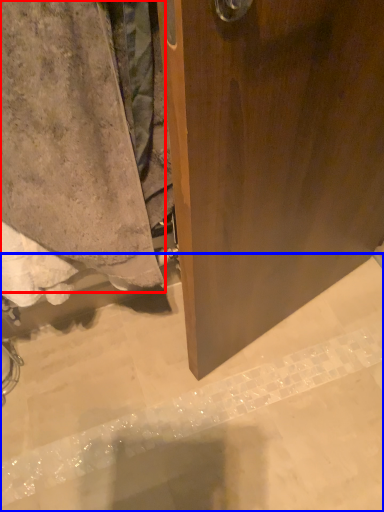
Question: Which point is further to the camera, towel (highlighted by a red box) or concrete (highlighted by a blue box)?

Choices:
 (A) towel
 (B) concrete

Answer: (B)